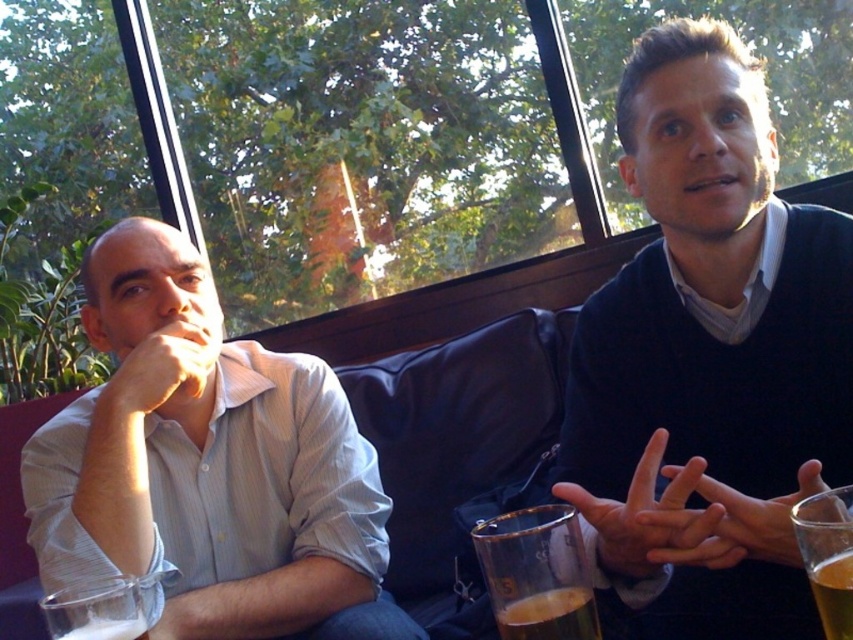
Question: Estimate the real-world distances between objects in this image. Which object is closer to the clear glass beer at lower left?

Choices:
 (A) translucent glass at right
 (B) translucent glass beer at lower left
 (C) white striped shirt at left
 (D) translucent glass beer at lower center

Answer: (B)

Question: Which point is closer to the camera?

Choices:
 (A) white striped shirt at left
 (B) translucent glass beer at lower left
 (C) clear glass beer at lower left
 (D) translucent glass at lower center

Answer: (D)

Question: In this image, where is white striped shirt at left located relative to translucent glass beer at lower center?

Choices:
 (A) left
 (B) right

Answer: (A)

Question: Estimate the real-world distances between objects in this image. Which object is farther from the clear glass beer at lower left?

Choices:
 (A) translucent glass beer at lower left
 (B) white striped shirt at left

Answer: (B)

Question: Can you confirm if white striped shirt at left is positioned to the right of translucent glass beer at lower left?

Choices:
 (A) yes
 (B) no

Answer: (B)

Question: Does clear glass beer at lower left appear on the right side of translucent glass beer at lower center?

Choices:
 (A) no
 (B) yes

Answer: (A)